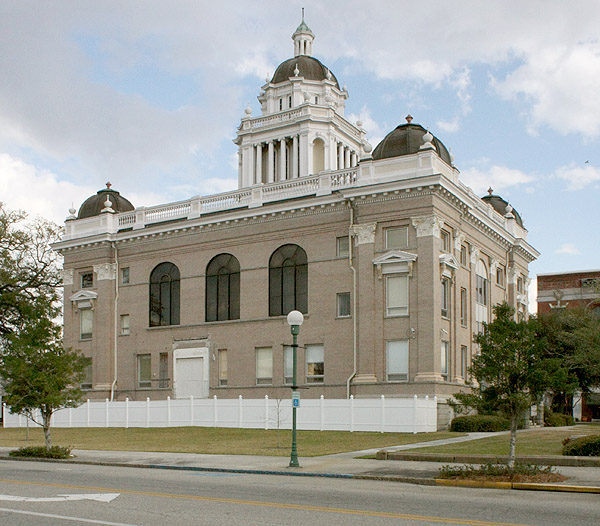
Where is `curved window`? The width and height of the screenshot is (600, 526). curved window is located at coordinates (293, 276).